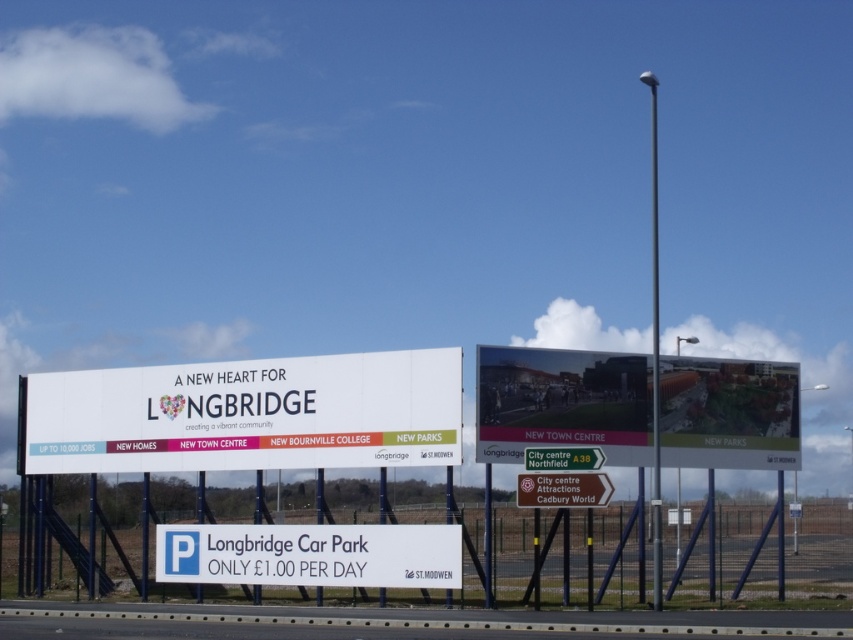
Does matte plastic billboard at center lie in front of black metal pole at center?

No, matte plastic billboard at center is behind black metal pole at center.

Who is higher up, matte plastic billboard at center or black metal pole at center?

black metal pole at center is higher up.

At what (x,y) coordinates should I click in order to perform the action: click on matte plastic billboard at center. Please return your answer as a coordinate pair (x, y). The width and height of the screenshot is (853, 640). Looking at the image, I should click on (563, 403).

Identify the location of matte plastic billboard at center. (563, 403).

The image size is (853, 640). Identify the location of black metal pole at center. (654, 355).

Looking at this image, which of these two, black metal pole at center or metallic signpost at center, stands shorter?

Standing shorter between the two is metallic signpost at center.

Where is `black metal pole at center`? black metal pole at center is located at coordinates (654, 355).

Find the location of a particular element. The width and height of the screenshot is (853, 640). black metal pole at center is located at coordinates (654, 355).

Does white matte signboard at center appear on the left side of white plastic sign at lower center?

Indeed, white matte signboard at center is positioned on the left side of white plastic sign at lower center.

Identify the location of white matte signboard at center. The image size is (853, 640). (245, 413).